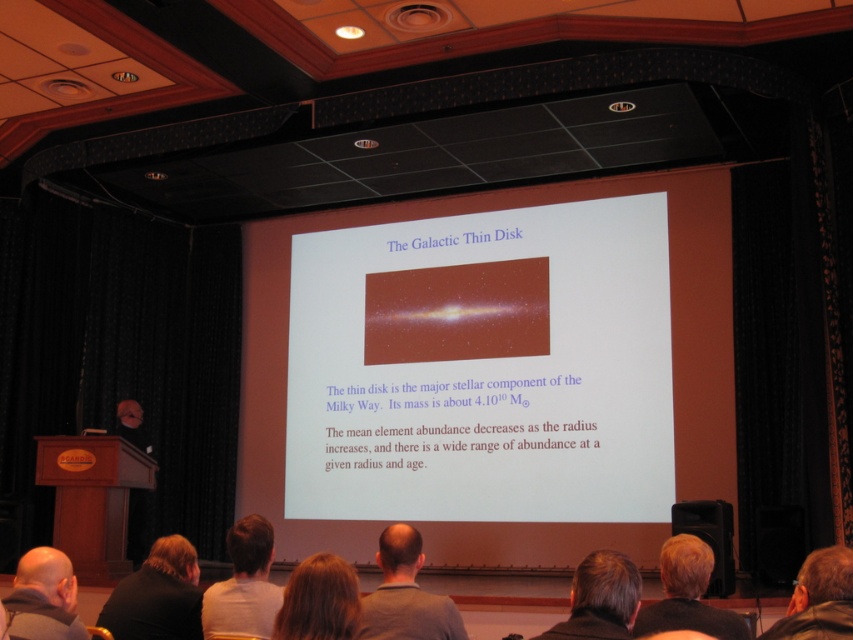
Can you confirm if matte orange slide at center is bigger than dark brown hair at lower left?

Indeed, matte orange slide at center has a larger size compared to dark brown hair at lower left.

Is point (558, 275) in front of point (154, 586)?

No, it is behind (154, 586).

The height and width of the screenshot is (640, 853). Identify the location of matte orange slide at center. (483, 368).

Is dark brown hair at lower left to the right of bald head at lower left from the viewer's perspective?

Indeed, dark brown hair at lower left is positioned on the right side of bald head at lower left.

Between point (157, 573) and point (45, 612), which one is positioned behind?

The point (157, 573) is more distant.

What are the coordinates of `dark brown hair at lower left` in the screenshot? It's located at (157, 595).

Image resolution: width=853 pixels, height=640 pixels. What do you see at coordinates (483, 368) in the screenshot? I see `matte orange slide at center` at bounding box center [483, 368].

Image resolution: width=853 pixels, height=640 pixels. Identify the location of matte orange slide at center. (483, 368).